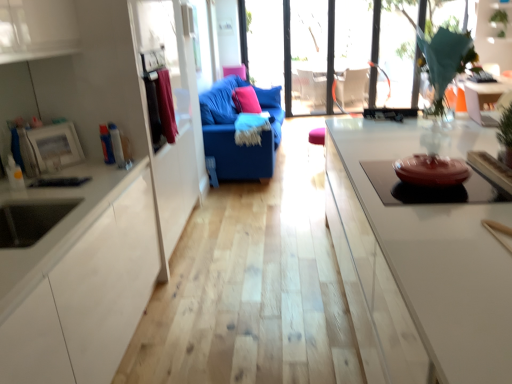
Question: From the image's perspective, is pink fabric pillow at center, placed as the 2th pillow when sorted from front to back, located above or below velvet blue sofa at center?

Choices:
 (A) above
 (B) below

Answer: (A)

Question: Is point (256, 87) closer or farther from the camera than point (226, 142)?

Choices:
 (A) farther
 (B) closer

Answer: (A)

Question: Estimate the real-world distances between objects in this image. Which object is closer to the transparent glass window at upper center, positioned as the 1th window in right-to-left order?

Choices:
 (A) pink fabric pillow at center, placed as the 2th pillow when sorted from front to back
 (B) white glossy table at upper right
 (C) pink fabric pillow at center, which appears as the 1th pillow when viewed from the front
 (D) green leafy plant at upper right
 (E) velvet blue sofa at center

Answer: (A)

Question: Which of these objects is positioned farthest from the transparent glass window at upper center, positioned as the first window in left-to-right order?

Choices:
 (A) green leafy plant at upper right
 (B) transparent glass window at upper center, which is counted as the 2th window, starting from the left
 (C) transparent glass door at center
 (D) white glossy table at upper right
 (E) pink fabric pillow at center, placed as the 2th pillow when sorted from front to back

Answer: (D)